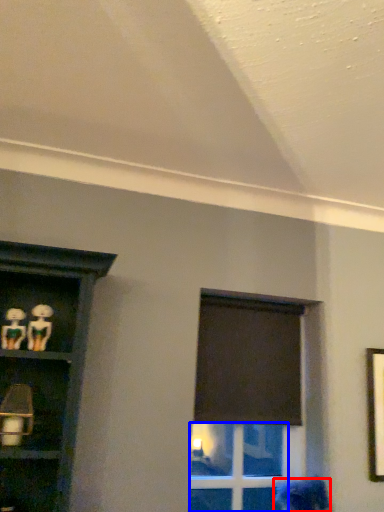
Question: Which object is further to the camera taking this photo, woman (highlighted by a red box) or glass door (highlighted by a blue box)?

Choices:
 (A) woman
 (B) glass door

Answer: (B)